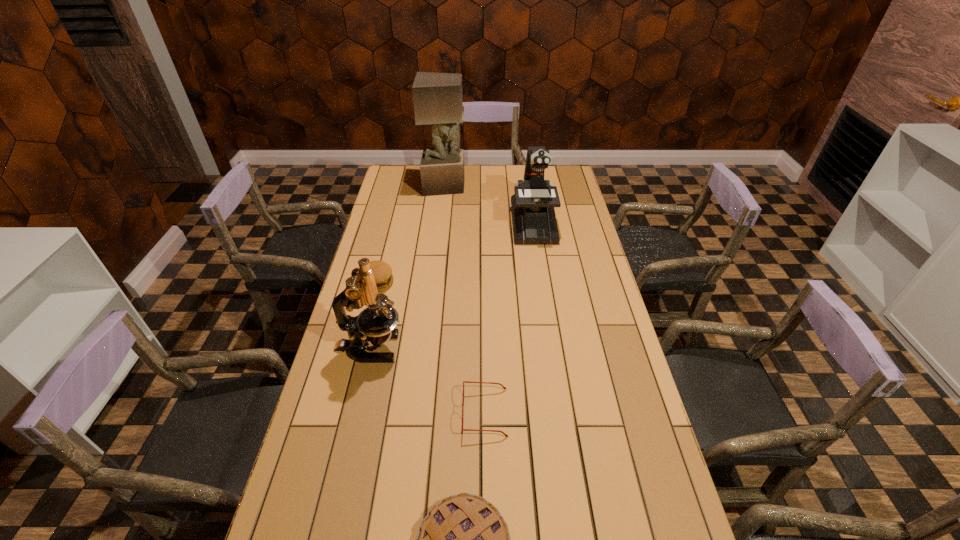
At what (x,y) coordinates should I click in order to perform the action: click on object present at the right edge. Please return your answer as a coordinate pair (x, y). Looking at the image, I should click on (532, 206).

Identify the location of vacant space at the far edge. The height and width of the screenshot is (540, 960). (516, 177).

I want to click on vacant space at the left edge of the desktop, so click(362, 392).

Locate an element on the screen. blank space at the right edge is located at coordinates (618, 503).

At what (x,y) coordinates should I click in order to perform the action: click on vacant area that lies between the nearer microscope and the sculpture. Please return your answer as a coordinate pair (x, y). Image resolution: width=960 pixels, height=540 pixels. Looking at the image, I should click on (407, 267).

I want to click on vacant space in between the fourth farthest object and the rightmost object, so click(x=451, y=286).

Find the location of a particular element. Image resolution: width=960 pixels, height=540 pixels. blank region between the spectacles and the rightmost object is located at coordinates (509, 319).

Where is `empty space between the rightmost object and the sculpture`? This screenshot has width=960, height=540. empty space between the rightmost object and the sculpture is located at coordinates (489, 205).

Where is `unoccupied area between the hamburger and the fifth farthest object`? unoccupied area between the hamburger and the fifth farthest object is located at coordinates (431, 348).

Locate an element on the screen. Image resolution: width=960 pixels, height=540 pixels. vacant space that is in between the rightmost object and the third shortest object is located at coordinates (455, 253).